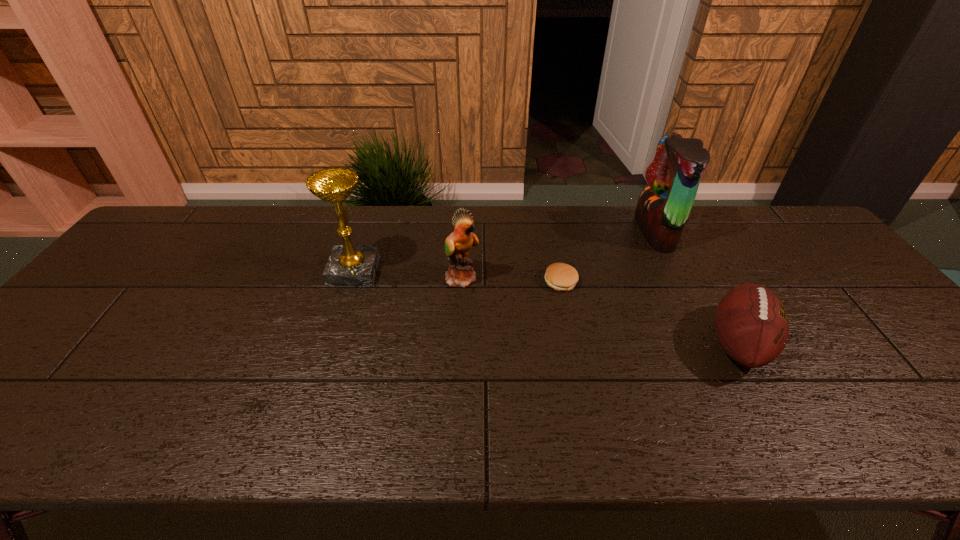
At what (x,y) coordinates should I click in order to perform the action: click on free area in between the third object from left to right and the fourth tallest object. Please return your answer as a coordinate pair (x, y). The width and height of the screenshot is (960, 540). Looking at the image, I should click on (650, 313).

This screenshot has width=960, height=540. I want to click on free space between the patty and the football (American), so click(x=650, y=313).

Locate an element on the screen. This screenshot has width=960, height=540. vacant space in between the nearest object and the farther parrot is located at coordinates (697, 288).

At what (x,y) coordinates should I click in order to perform the action: click on vacant space that's between the football (American) and the farthest object. Please return your answer as a coordinate pair (x, y). Image resolution: width=960 pixels, height=540 pixels. Looking at the image, I should click on (697, 288).

Where is `free area in between the nearer parrot and the nearest object`? This screenshot has height=540, width=960. free area in between the nearer parrot and the nearest object is located at coordinates (600, 310).

Where is `free area in between the nearest object and the patty`? The image size is (960, 540). free area in between the nearest object and the patty is located at coordinates (650, 313).

At what (x,y) coordinates should I click in order to perform the action: click on free space between the patty and the farther parrot. Please return your answer as a coordinate pair (x, y). The width and height of the screenshot is (960, 540). Looking at the image, I should click on (608, 257).

Where is `object that ranks as the second closest to the third shortest object`? The width and height of the screenshot is (960, 540). object that ranks as the second closest to the third shortest object is located at coordinates (348, 265).

The height and width of the screenshot is (540, 960). Identify the location of object that is the second closest one to the taller parrot. (560, 276).

You are a GUI agent. You are given a task and a screenshot of the screen. Output one action in this format:
    pyautogui.click(x=<x>, y=<y>)
    Task: Click on the free location that satisfies the following two spatial constraints: 1. on the front-facing side of the patty; 2. on the left side of the leftmost object
    This screenshot has height=540, width=960.
    Given the screenshot: What is the action you would take?
    pyautogui.click(x=350, y=282)